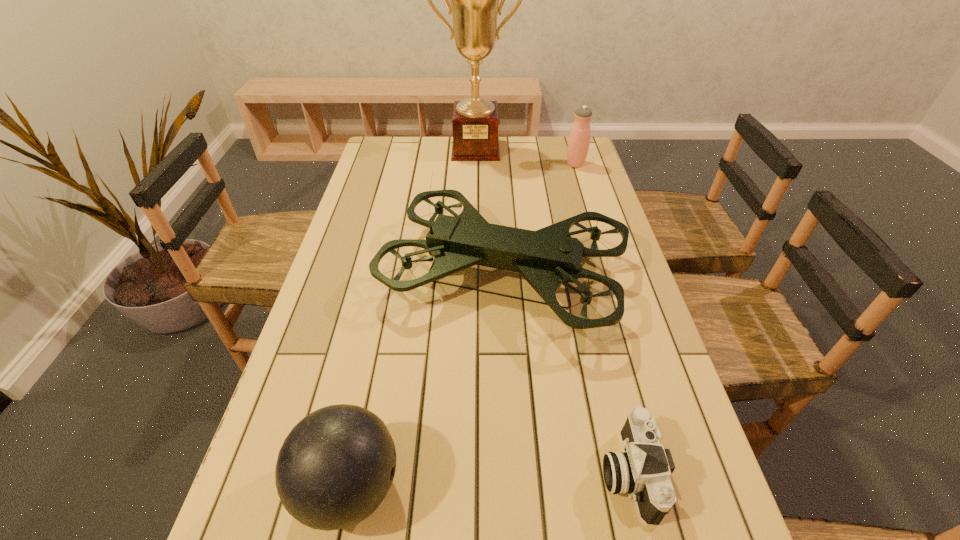
Locate an element on the screen. The width and height of the screenshot is (960, 540). thermos bottle that is at the far edge is located at coordinates (579, 139).

The image size is (960, 540). In order to click on object positioned at the left edge in this screenshot , I will do `click(546, 258)`.

Locate an element on the screen. The height and width of the screenshot is (540, 960). drone at the right edge is located at coordinates (546, 258).

Identify the location of thermos bottle present at the right edge. Image resolution: width=960 pixels, height=540 pixels. (579, 139).

At what (x,y) coordinates should I click in order to perform the action: click on camera present at the right edge. Please return your answer as a coordinate pair (x, y). Image resolution: width=960 pixels, height=540 pixels. Looking at the image, I should click on (643, 470).

The image size is (960, 540). In order to click on object that is at the far right corner in this screenshot , I will do `click(579, 139)`.

You are a GUI agent. You are given a task and a screenshot of the screen. Output one action in this format:
    pyautogui.click(x=<x>, y=<y>)
    Task: Click on the vacant region at the left edge of the desktop
    The width and height of the screenshot is (960, 540).
    Given the screenshot: What is the action you would take?
    pyautogui.click(x=376, y=249)

In the image, there is a desktop. At what (x,y) coordinates should I click in order to perform the action: click on vacant space at the right edge. Please return your answer as a coordinate pair (x, y). Looking at the image, I should click on (645, 402).

The width and height of the screenshot is (960, 540). What are the coordinates of `vacant space at the far left corner of the desktop` in the screenshot? It's located at pyautogui.click(x=413, y=138).

The height and width of the screenshot is (540, 960). In order to click on vacant space at the far right corner of the desktop in this screenshot , I will do `click(562, 153)`.